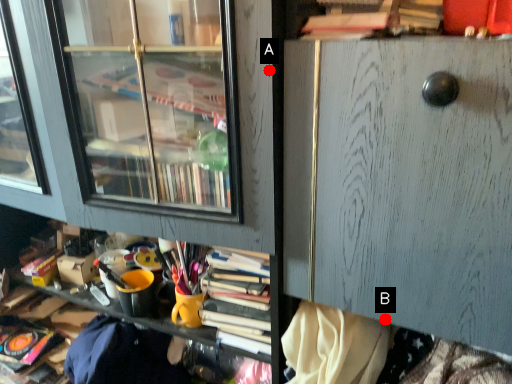
Question: Two points are circled on the image, labeled by A and B beside each circle. Which point is farther to the camera?

Choices:
 (A) A is further
 (B) B is further

Answer: (B)